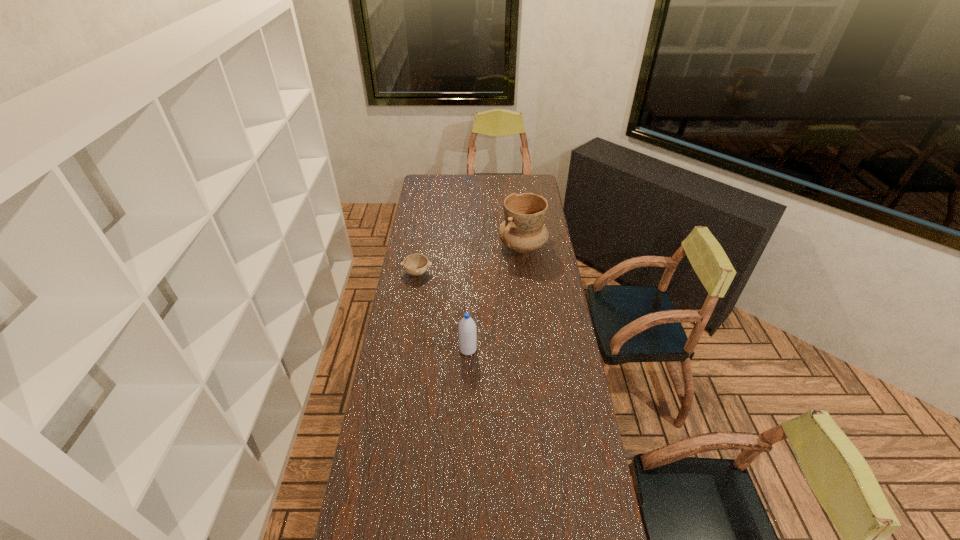
You are a GUI agent. You are given a task and a screenshot of the screen. Output one action in this format:
    pyautogui.click(x=<x>, y=<y>)
    Task: Click on the tallest object
    The image size is (960, 540).
    Given the screenshot: What is the action you would take?
    pyautogui.click(x=523, y=230)

The width and height of the screenshot is (960, 540). I want to click on the rightmost object, so (523, 230).

In order to click on the second tallest object in this screenshot , I will do `click(467, 333)`.

Identify the location of the second object from left to right. (467, 333).

The image size is (960, 540). I want to click on the leftmost object, so click(416, 264).

At what (x,y) coordinates should I click in order to perform the action: click on the second farthest object. Please return your answer as a coordinate pair (x, y). The image size is (960, 540). Looking at the image, I should click on (416, 264).

I want to click on free space located on the left of the rightmost object, so click(475, 246).

Locate an element on the screen. This screenshot has height=540, width=960. free space located 0.060m on the back of the water bottle is located at coordinates (468, 332).

You are a GUI agent. You are given a task and a screenshot of the screen. Output one action in this format:
    pyautogui.click(x=<x>, y=<y>)
    Task: Click on the vacant position located on the right of the second farthest object
    The height and width of the screenshot is (540, 960).
    Given the screenshot: What is the action you would take?
    pyautogui.click(x=489, y=273)

The height and width of the screenshot is (540, 960). I want to click on object located in the left edge section of the desktop, so click(416, 264).